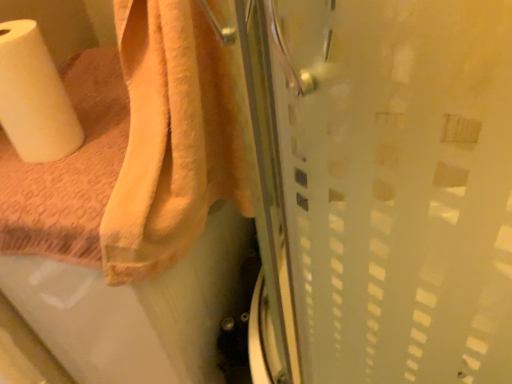
Question: Is white matte paper towel at left at the left side of orange cotton towel at upper left?

Choices:
 (A) no
 (B) yes

Answer: (B)

Question: Is white matte paper towel at left behind orange cotton towel at upper left?

Choices:
 (A) no
 (B) yes

Answer: (B)

Question: Does white matte paper towel at left have a greater height compared to orange cotton towel at upper left?

Choices:
 (A) no
 (B) yes

Answer: (A)

Question: Does white matte paper towel at left have a smaller size compared to orange cotton towel at upper left?

Choices:
 (A) no
 (B) yes

Answer: (B)

Question: Is white matte paper towel at left positioned with its back to orange cotton towel at upper left?

Choices:
 (A) yes
 (B) no

Answer: (B)

Question: Is the surface of white matte paper towel at left in direct contact with orange cotton towel at upper left?

Choices:
 (A) no
 (B) yes

Answer: (A)

Question: Considering the relative sizes of orange cotton towel at upper left and white matte paper towel at left in the image provided, is orange cotton towel at upper left taller than white matte paper towel at left?

Choices:
 (A) yes
 (B) no

Answer: (A)

Question: Could you tell me if orange cotton towel at upper left is facing white matte paper towel at left?

Choices:
 (A) yes
 (B) no

Answer: (B)

Question: Does orange cotton towel at upper left have a smaller size compared to white matte paper towel at left?

Choices:
 (A) no
 (B) yes

Answer: (A)

Question: Does orange cotton towel at upper left have a larger size compared to white matte paper towel at left?

Choices:
 (A) yes
 (B) no

Answer: (A)

Question: Considering the relative positions of orange cotton towel at upper left and white matte paper towel at left in the image provided, is orange cotton towel at upper left behind white matte paper towel at left?

Choices:
 (A) yes
 (B) no

Answer: (B)

Question: Can you confirm if orange cotton towel at upper left is positioned to the right of white matte paper towel at left?

Choices:
 (A) yes
 (B) no

Answer: (A)

Question: Is white matte paper towel at left inside the boundaries of orange cotton towel at upper left, or outside?

Choices:
 (A) outside
 (B) inside

Answer: (A)